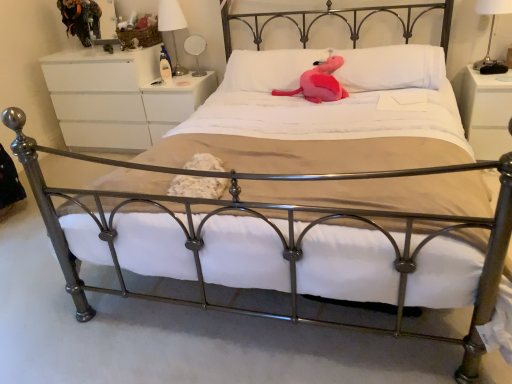
Question: From a real-world perspective, is white glossy lampshade at upper center, acting as the 1th bedside lamp starting from the back, physically located above or below pink plush at center, the 1th pillow from the right?

Choices:
 (A) above
 (B) below

Answer: (A)

Question: Is point (174, 46) closer or farther from the camera than point (243, 52)?

Choices:
 (A) closer
 (B) farther

Answer: (B)

Question: Considering the real-world distances, which object is closest to the white glossy nightstand at center, which is counted as the second nightstand, starting from the left?

Choices:
 (A) pink plush at center, the 2th pillow viewed from the right
 (B) pink plush toy at center
 (C) white glossy lampshade at upper center, acting as the 1th bedside lamp starting from the back
 (D) white matte dresser at upper left, which is the first nightstand in left-to-right order
 (E) white glossy nightstand at right, which appears as the third nightstand when viewed from the left

Answer: (D)

Question: Estimate the real-world distances between objects in this image. Which object is closer to the white matte dresser at upper left, which is the first nightstand in left-to-right order?

Choices:
 (A) white glossy lampshade at upper center, placed as the 2th bedside lamp when sorted from front to back
 (B) white fabric lampshade at upper right, acting as the 2th bedside lamp starting from the back
 (C) pink plush toy at center
 (D) pink plush at center, the 2th pillow viewed from the right
 (E) white glossy nightstand at center, which is counted as the 2th nightstand, starting from the right

Answer: (E)